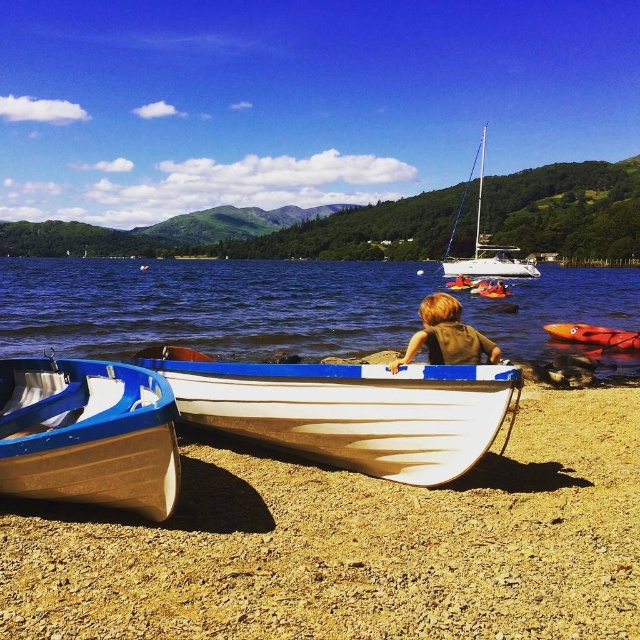
You are planning to store both the wooden boat at lower center and the white glossy boat at center in a storage shed. The shed has a width of 2 meters. Based on the scene description, can both boats fit side by side in the shed?

The wooden boat at lower center might be wider than the white glossy boat at center. Since the shed is only 2 meters wide, it is uncertain if both can fit side by side without overlapping. The exact widths are not provided, so further measurement is needed.

You are standing at the lakeside and want to determine which of the two points, point (481, 156) or point (486, 291), is closer to you. Based on the scene, which point is nearer?

Point (481, 156) is closer to you because it is further to the viewer than point (486, 291).

You are standing at the point marked by coordinates point [484,243]. What object is located exactly at this point?

The white glossy sailboat at upper center is located exactly at point [484,243].